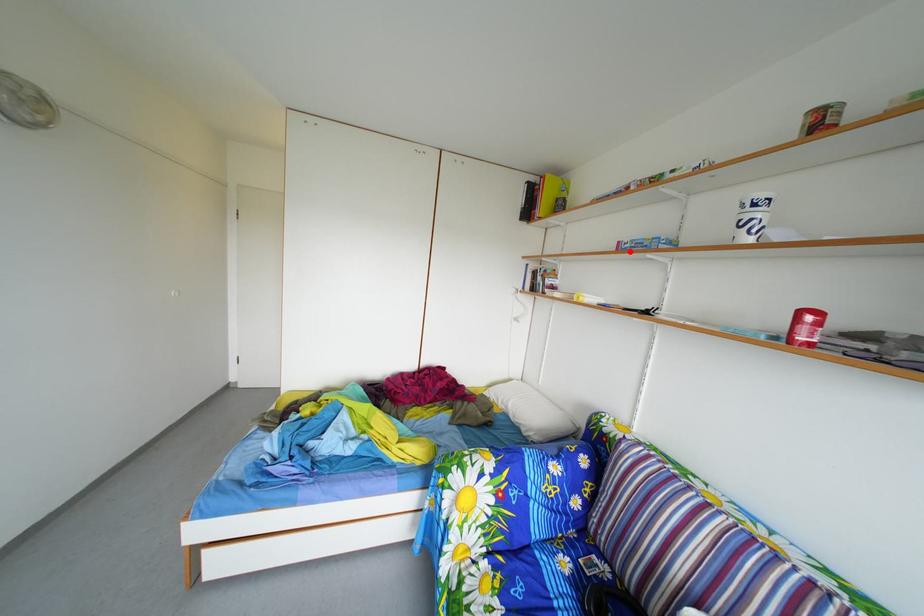
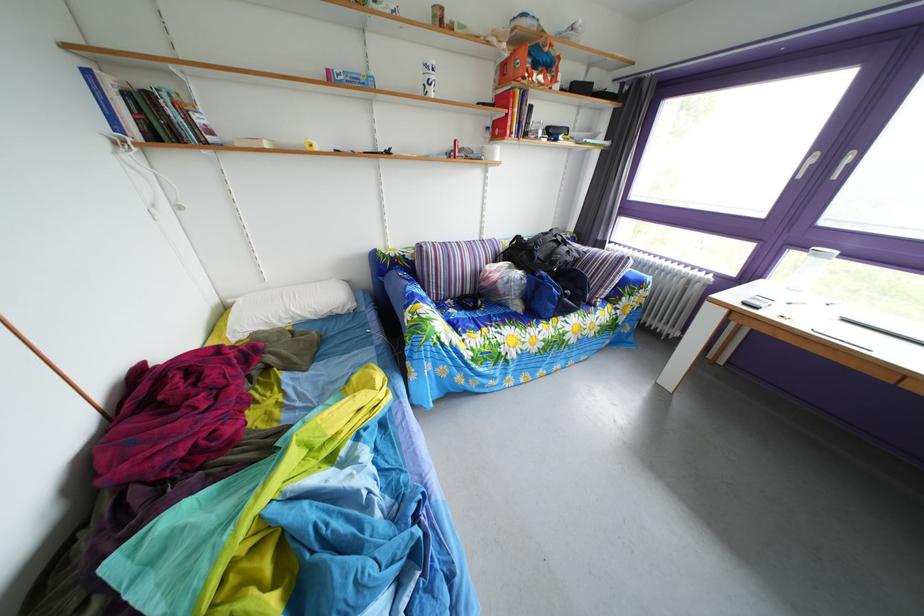
Locate, in the second image, the point that corresponds to the highlighted location in the first image.

(339, 79)